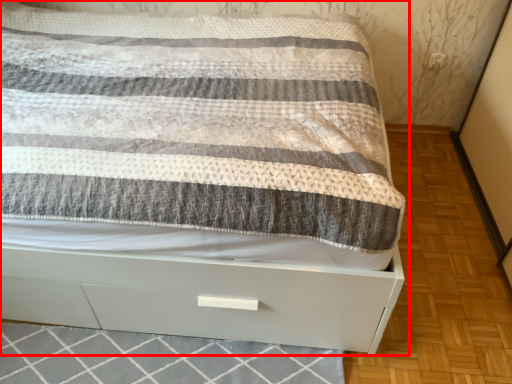
Question: Considering the relative positions of bed (annotated by the red box) and tile in the image provided, where is bed (annotated by the red box) located with respect to the staircase?

Choices:
 (A) left
 (B) right

Answer: (A)